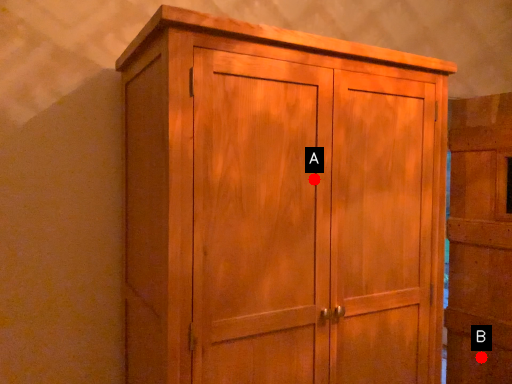
Question: Two points are circled on the image, labeled by A and B beside each circle. Which point is closer to the camera taking this photo?

Choices:
 (A) A is closer
 (B) B is closer

Answer: (A)